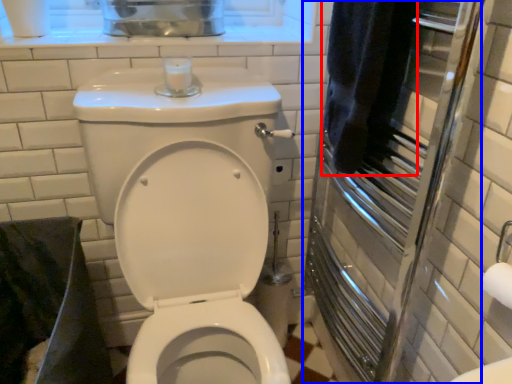
Question: Which point is closer to the camera, bath towel (highlighted by a red box) or screen door (highlighted by a blue box)?

Choices:
 (A) bath towel
 (B) screen door

Answer: (B)